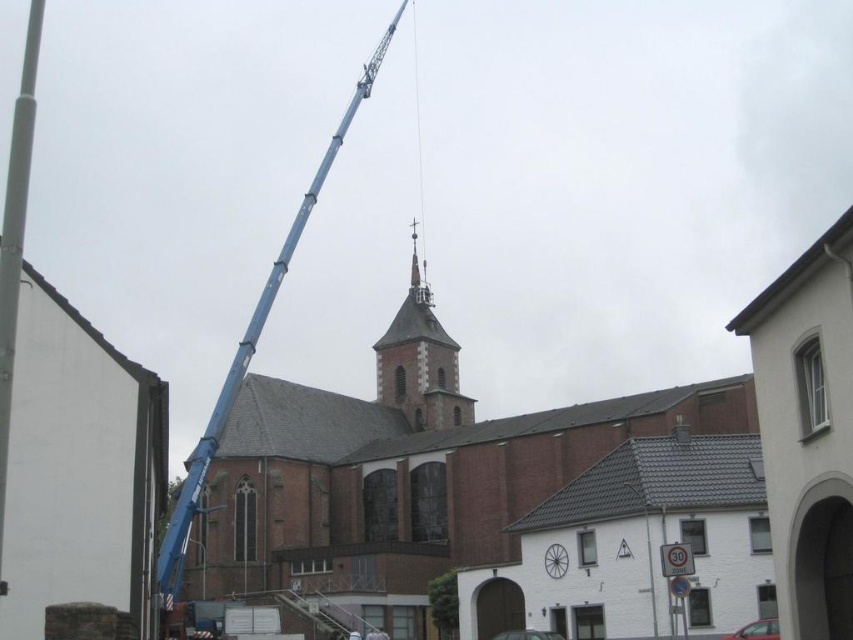
Can you confirm if blue metallic crane at upper left is shorter than smooth brown leather belt at center?

Incorrect, blue metallic crane at upper left's height does not fall short of smooth brown leather belt at center's.

Is blue metallic crane at upper left further to camera compared to smooth brown leather belt at center?

No, it is in front of smooth brown leather belt at center.

Describe the element at coordinates (248, 353) in the screenshot. I see `blue metallic crane at upper left` at that location.

Locate an element on the screen. blue metallic crane at upper left is located at coordinates (248, 353).

Who is positioned more to the right, brick church at center or smooth stone tower at center?

Positioned to the right is smooth stone tower at center.

Locate an element on the screen. The image size is (853, 640). brick church at center is located at coordinates (485, 500).

Where is `brick church at center`? brick church at center is located at coordinates (485, 500).

Which of these two, blue metallic crane at upper left or smooth white pole at left, stands taller?

With more height is blue metallic crane at upper left.

Does blue metallic crane at upper left have a lesser height compared to smooth white pole at left?

In fact, blue metallic crane at upper left may be taller than smooth white pole at left.

Describe the element at coordinates (248, 353) in the screenshot. This screenshot has width=853, height=640. I see `blue metallic crane at upper left` at that location.

This screenshot has width=853, height=640. I want to click on blue metallic crane at upper left, so click(248, 353).